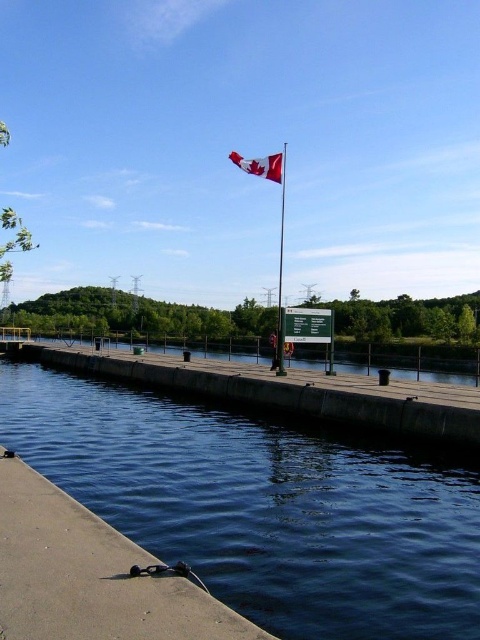
You are standing on the dark blue concrete at lower left and want to walk to the Canadian flag at the far end of the dock. Which direction should you head relative to the concrete dock at lower left?

You should head to the left side of the concrete dock at lower left since the dark blue concrete at lower left is positioned on the right side of it, meaning the dock extends to your left from there.

You are standing at the end of the concrete dock at lower left and want to see the red fabric flag at upper center. Is there any obstruction between you and the flag?

The concrete dock at lower left is in front of the red fabric flag at upper center, so there is an obstruction between you and the flag.

You are standing on the dark blue concrete at lower left and want to reach the red fabric flag at upper center. The path is straight and unobstructed. If you walk at a constant speed of 1.5 meters per second, how many seconds will it take you to reach the flag?

The distance between the dark blue concrete at lower left and the red fabric flag at upper center is 18.86 meters. At a speed of 1.5 meters per second, dividing the distance by speed gives 18.86 divided by 1.5, which equals approximately 12.57 seconds. So, it will take roughly 12.6 seconds to reach the flag.